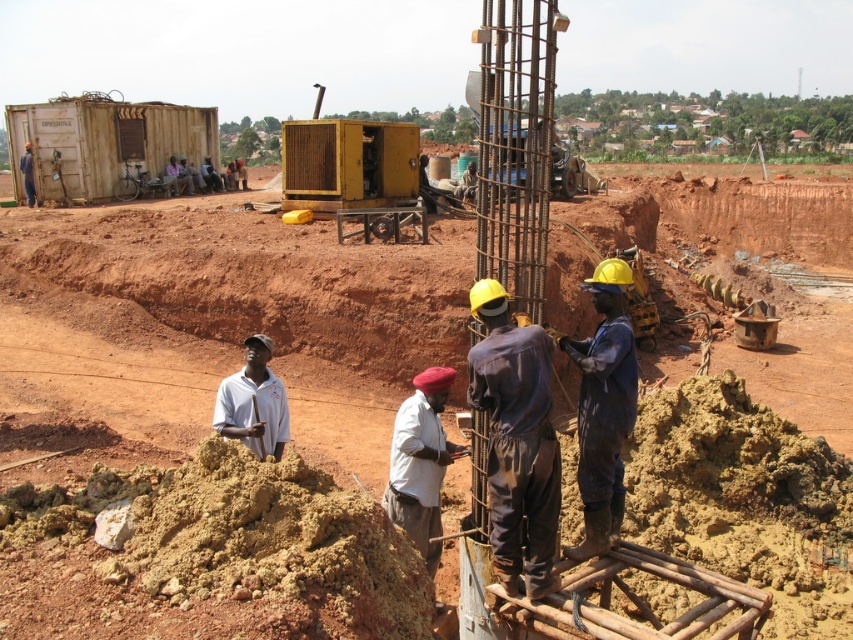
You are a construction worker who needs to move the dark blue fabric at center to the left. Can you do so without moving the metallic yellow generator at center first?

The metallic yellow generator at center is positioned on the right side of dark blue fabric at center, so you can move the dark blue fabric at center to the left without moving the metallic yellow generator at center first because the generator is already to the right of it.

You are a construction worker standing at the entrance of the construction site. You need to locate the white fabric at center. According to the coordinates provided, where should you look to find it?

The white fabric at center is located at coordinates point (x=421, y=464).